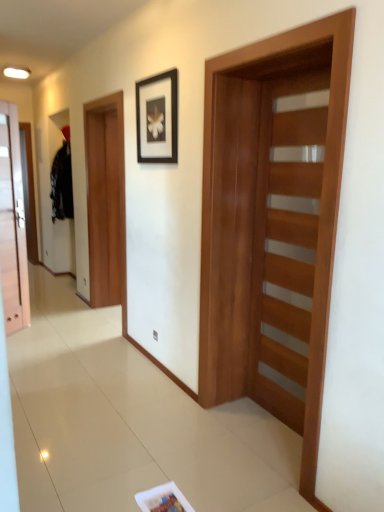
Locate an element on the screen. This screenshot has height=512, width=384. free space above white glossy magazine at lower center (from a real-world perspective) is located at coordinates (162, 496).